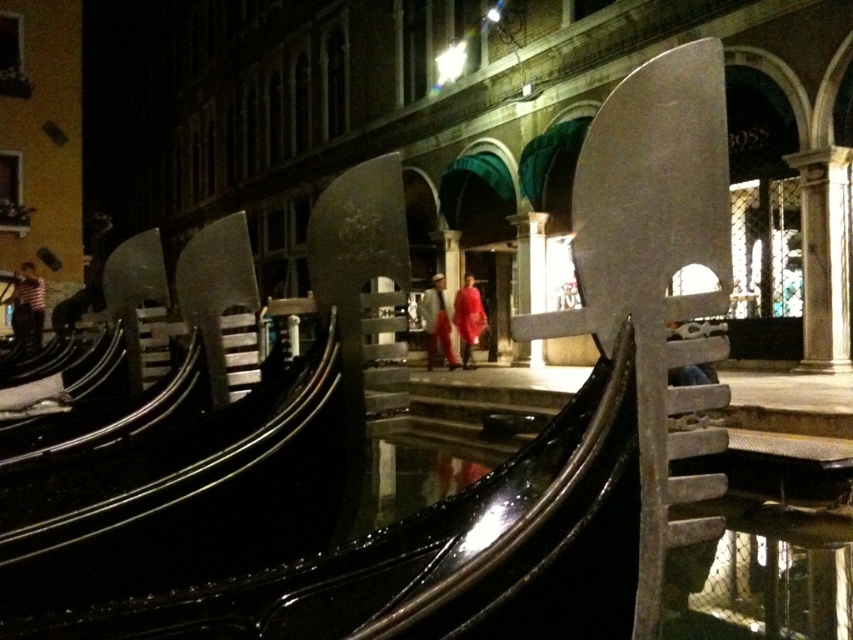
You are a traveler who wants to pack a striped cotton shirt at left and a red fabric coat at center into a suitcase. The suitcase can only fit one of them. Which item should you choose to maximize space efficiency?

The striped cotton shirt at left has a larger size compared to the red fabric coat at center, so you should choose the red fabric coat at center to maximize space efficiency because it takes up less space.

You are a tourist standing in front of the historic buildings in Venice, Italy. You notice two points marked as point (x=444, y=291) and point (x=474, y=340) in the scene. Which point is closer to your current position?

Point (x=444, y=291) is closer to your current position because it is further to the camera than point (x=474, y=340), meaning it appears nearer in the image.

You are a tourist in Venice, and you see two red items hanging on a rack between two gondolas at the center of the scene. Which one is taller, the red fabric coat at center or the matte red cape at center?

The red fabric coat at center is much taller than the matte red cape at center.